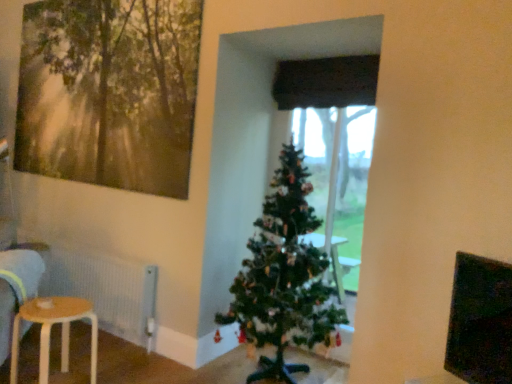
Describe the element at coordinates (106, 290) in the screenshot. I see `white textured radiator at lower left` at that location.

Where is `white textured radiator at lower left`? The width and height of the screenshot is (512, 384). white textured radiator at lower left is located at coordinates (106, 290).

The image size is (512, 384). What do you see at coordinates (50, 332) in the screenshot?
I see `light brown wooden stool at lower left` at bounding box center [50, 332].

What do you see at coordinates (480, 321) in the screenshot? The image size is (512, 384). I see `black matte window screen at upper right` at bounding box center [480, 321].

Locate an element on the screen. white textured radiator at lower left is located at coordinates (106, 290).

Is black fabric curtain at center next to light brown wooden stool at lower left?

No, black fabric curtain at center is not touching light brown wooden stool at lower left.

Considering the relative positions of black fabric curtain at center and light brown wooden stool at lower left in the image provided, is black fabric curtain at center to the left of light brown wooden stool at lower left from the viewer's perspective?

In fact, black fabric curtain at center is to the right of light brown wooden stool at lower left.

Is black fabric curtain at center facing away from light brown wooden stool at lower left?

No, light brown wooden stool at lower left is not at the back of black fabric curtain at center.

Between point (302, 76) and point (41, 353), which one is positioned behind?

Point (302, 76)

Is light brown wooden stool at lower left outside of black matte window screen at upper right?

light brown wooden stool at lower left is positioned outside black matte window screen at upper right.

Is the position of light brown wooden stool at lower left less distant than that of black matte window screen at upper right?

No, it is behind black matte window screen at upper right.

From the image's perspective, is light brown wooden stool at lower left positioned above or below black matte window screen at upper right?

light brown wooden stool at lower left is situated lower than black matte window screen at upper right in the image.

Which is more to the left, wooden painting at upper left or black fabric curtain at center?

From the viewer's perspective, wooden painting at upper left appears more on the left side.

Consider the image. Who is taller, wooden painting at upper left or black fabric curtain at center?

Standing taller between the two is wooden painting at upper left.

Based on the photo, can you tell me how much wooden painting at upper left and black fabric curtain at center differ in facing direction?

They differ by 0.963 degrees in their facing directions.

Considering the relative sizes of wooden painting at upper left and black fabric curtain at center in the image provided, is wooden painting at upper left thinner than black fabric curtain at center?

Answer: Yes, wooden painting at upper left is thinner than black fabric curtain at center.

From the picture: In the image, is light brown wooden stool at lower left on the left side or the right side of black fabric curtain at center?

Based on their positions, light brown wooden stool at lower left is located to the left of black fabric curtain at center.

Is light brown wooden stool at lower left positioned far away from black fabric curtain at center?

light brown wooden stool at lower left is far away from black fabric curtain at center.

From the picture: Can you confirm if light brown wooden stool at lower left is smaller than black fabric curtain at center?

Actually, light brown wooden stool at lower left might be larger than black fabric curtain at center.

From a real-world perspective, is light brown wooden stool at lower left positioned above or below black fabric curtain at center?

Clearly, from a real-world perspective, light brown wooden stool at lower left is below black fabric curtain at center.

How far apart are green matte christmas tree at center and black matte window screen at upper right?

green matte christmas tree at center and black matte window screen at upper right are 1.04 meters apart.

From a real-world perspective, between green matte christmas tree at center and black matte window screen at upper right, who is vertically lower?

green matte christmas tree at center is physically lower.

Which is closer to the camera, (267, 248) or (473, 308)?

The point (473, 308) is in front.

From the image's perspective, is white textured radiator at lower left on top of black matte window screen at upper right?

No.

Is white textured radiator at lower left surrounding black matte window screen at upper right?

No, black matte window screen at upper right is not a part of white textured radiator at lower left.

From a real-world perspective, is white textured radiator at lower left positioned under black matte window screen at upper right based on gravity?

Indeed, from a real-world perspective, white textured radiator at lower left is positioned beneath black matte window screen at upper right.

Is white textured radiator at lower left not close to black matte window screen at upper right?

Yes, white textured radiator at lower left is far from black matte window screen at upper right.

Would you say green matte christmas tree at center is outside wooden painting at upper left?

green matte christmas tree at center lies outside wooden painting at upper left's area.

In the scene shown: Considering the positions of objects green matte christmas tree at center and wooden painting at upper left in the image provided, who is behind, green matte christmas tree at center or wooden painting at upper left?

wooden painting at upper left.

Find the location of a particular element. christmas tree in front of the wooden painting at upper left is located at coordinates (284, 277).

The height and width of the screenshot is (384, 512). Identify the location of curtain that appears above the light brown wooden stool at lower left (from the image's perspective). (326, 82).

You are a GUI agent. You are given a task and a screenshot of the screen. Output one action in this format:
    pyautogui.click(x=<x>, y=<y>)
    Task: Click on the window screen above the light brown wooden stool at lower left (from a real-world perspective)
    The height and width of the screenshot is (384, 512).
    Given the screenshot: What is the action you would take?
    pyautogui.click(x=480, y=321)

Considering their positions, is green matte christmas tree at center positioned closer to wooden painting at upper left than white textured radiator at lower left?

white textured radiator at lower left is closer to wooden painting at upper left.

When comparing their distances from black matte window screen at upper right, does white textured radiator at lower left or green matte christmas tree at center seem closer?

Among the two, green matte christmas tree at center is located nearer to black matte window screen at upper right.

Which object lies further to the anchor point black fabric curtain at center, green matte christmas tree at center or black matte window screen at upper right?

The object further to black fabric curtain at center is black matte window screen at upper right.

Based on the photo, looking at the image, which one is located further to black matte window screen at upper right, wooden painting at upper left or light brown wooden stool at lower left?

wooden painting at upper left.

When comparing their distances from green matte christmas tree at center, does wooden painting at upper left or white textured radiator at lower left seem further?

wooden painting at upper left is further to green matte christmas tree at center.

Considering their positions, is white textured radiator at lower left positioned closer to black matte window screen at upper right than black fabric curtain at center?

black fabric curtain at center.

Considering their positions, is wooden painting at upper left positioned closer to green matte christmas tree at center than black matte window screen at upper right?

Among the two, black matte window screen at upper right is located nearer to green matte christmas tree at center.

From the image, which object appears to be nearer to light brown wooden stool at lower left, white textured radiator at lower left or black matte window screen at upper right?

Based on the image, white textured radiator at lower left appears to be nearer to light brown wooden stool at lower left.

The height and width of the screenshot is (384, 512). Find the location of `christmas tree between black matte window screen at upper right and black fabric curtain at center from front to back`. christmas tree between black matte window screen at upper right and black fabric curtain at center from front to back is located at coordinates (284, 277).

This screenshot has width=512, height=384. I want to click on christmas tree between wooden painting at upper left and light brown wooden stool at lower left in the vertical direction, so click(284, 277).

The height and width of the screenshot is (384, 512). Find the location of `christmas tree located between wooden painting at upper left and black matte window screen at upper right in the left-right direction`. christmas tree located between wooden painting at upper left and black matte window screen at upper right in the left-right direction is located at coordinates (284, 277).

Where is `christmas tree located between white textured radiator at lower left and black matte window screen at upper right in the left-right direction`? This screenshot has width=512, height=384. christmas tree located between white textured radiator at lower left and black matte window screen at upper right in the left-right direction is located at coordinates (284, 277).